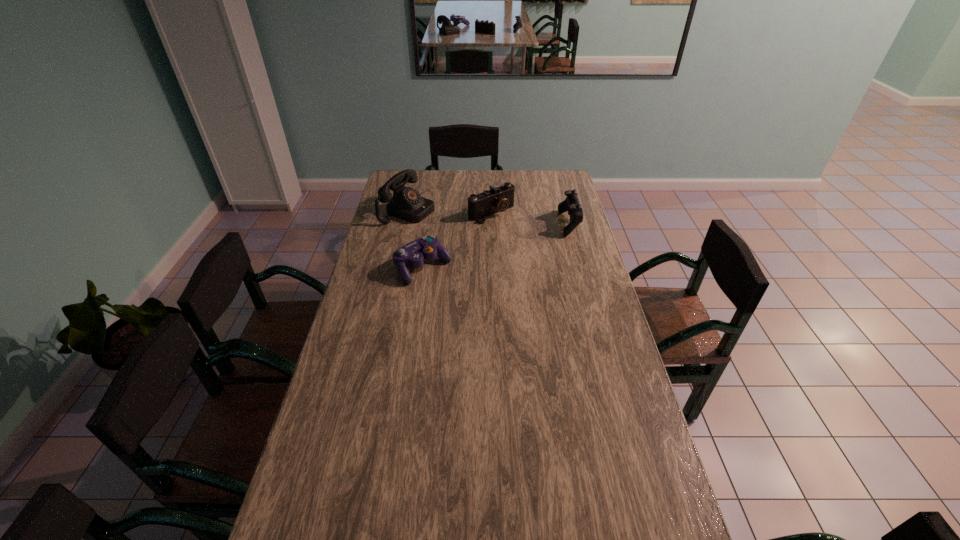
Where is `free space located on the front-facing side of the camera`? The height and width of the screenshot is (540, 960). free space located on the front-facing side of the camera is located at coordinates (516, 231).

The height and width of the screenshot is (540, 960). Find the location of `vacant area situated on the front-facing side of the camera`. vacant area situated on the front-facing side of the camera is located at coordinates (534, 245).

You are a GUI agent. You are given a task and a screenshot of the screen. Output one action in this format:
    pyautogui.click(x=<x>, y=<y>)
    Task: Click on the free space located 0.160m on the front-facing side of the camera
    
    Given the screenshot: What is the action you would take?
    pyautogui.click(x=527, y=240)

Locate an element on the screen. This screenshot has height=540, width=960. control present at the left edge is located at coordinates (412, 254).

Find the location of a particular element. telephone that is positioned at the left edge is located at coordinates (407, 204).

The width and height of the screenshot is (960, 540). Identify the location of object that is positioned at the right edge. (571, 204).

In the image, there is a desktop. Identify the location of vacant space at the far edge. (435, 173).

Identify the location of free space at the near edge of the desktop. This screenshot has width=960, height=540. (414, 536).

Where is `vacant area at the left edge of the desktop`? The height and width of the screenshot is (540, 960). vacant area at the left edge of the desktop is located at coordinates (346, 437).

Locate an element on the screen. vacant space at the right edge of the desktop is located at coordinates (598, 275).